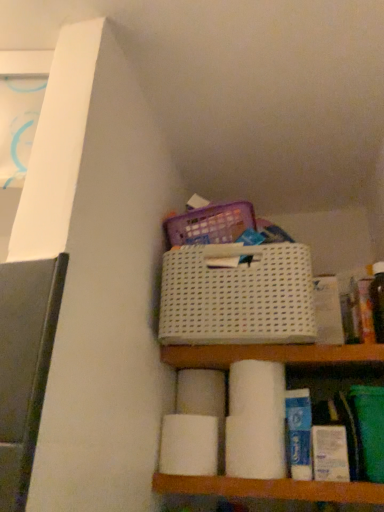
What do you see at coordinates (256, 421) in the screenshot?
I see `white matte toilet paper at center, the first toilet paper when ordered from front to back` at bounding box center [256, 421].

How much space does white matte toilet paper at center, the first toilet paper when ordered from front to back, occupy horizontally?

The width of white matte toilet paper at center, the first toilet paper when ordered from front to back, is 1.88 inches.

Locate an element on the screen. This screenshot has height=512, width=384. white matte toilet paper at lower center, arranged as the first toilet paper when viewed from the back is located at coordinates click(201, 393).

From the image's perspective, which object appears higher, white matte toilet paper at center, the 2th toilet paper from the front, or white mesh basket at center?

From the image's view, white mesh basket at center is above.

Based on their positions, is white matte toilet paper at center, the 2th toilet paper from the front, located to the left or right of white mesh basket at center?

white matte toilet paper at center, the 2th toilet paper from the front, is positioned on white mesh basket at center's left side.

In order to click on the 2nd toilet paper behind when counting from the white mesh basket at center in this screenshot , I will do `click(189, 445)`.

From the image's perspective, which one is positioned higher, white matte toilet paper at center, the 2th toilet paper from the front, or white matte toilet paper at lower center, arranged as the first toilet paper when viewed from the back?

white matte toilet paper at lower center, arranged as the first toilet paper when viewed from the back, from the image's perspective.

From their relative heights in the image, would you say white matte toilet paper at center, the 2th toilet paper from the front, is taller or shorter than white matte toilet paper at lower center, the third toilet paper when ordered from front to back?

Considering their sizes, white matte toilet paper at center, the 2th toilet paper from the front, has more height than white matte toilet paper at lower center, the third toilet paper when ordered from front to back.

Is white matte toilet paper at center, the 2th toilet paper from the front, in front of or behind white matte toilet paper at lower center, arranged as the first toilet paper when viewed from the back, in the image?

In the image, white matte toilet paper at center, the 2th toilet paper from the front, appears in front of white matte toilet paper at lower center, arranged as the first toilet paper when viewed from the back.

From the image's perspective, which toilet paper is the 2nd one below the white matte toilet paper at lower center, arranged as the first toilet paper when viewed from the back? Please provide its 2D coordinates.

[(189, 445)]

Considering the sizes of objects white matte toilet paper at center, the 2th toilet paper from the front, and white matte toilet paper at center, the first toilet paper when ordered from front to back, in the image provided, who is shorter, white matte toilet paper at center, the 2th toilet paper from the front, or white matte toilet paper at center, the first toilet paper when ordered from front to back,?

With less height is white matte toilet paper at center, the 2th toilet paper from the front.

Is white matte toilet paper at center, the 2th toilet paper from the front, far from white matte toilet paper at center, which is the third toilet paper in back-to-front order?

No, white matte toilet paper at center, the 2th toilet paper from the front, is not far from white matte toilet paper at center, which is the third toilet paper in back-to-front order.

Is white matte toilet paper at center, the 2th toilet paper from the front, completely or partially outside of white matte toilet paper at center, the first toilet paper when ordered from front to back?

That's correct, white matte toilet paper at center, the 2th toilet paper from the front, is outside of white matte toilet paper at center, the first toilet paper when ordered from front to back.

In order to click on basket on the right of white matte toilet paper at lower center, the third toilet paper when ordered from front to back in this screenshot , I will do `click(237, 298)`.

Which object is further away from the camera taking this photo, white matte toilet paper at lower center, arranged as the first toilet paper when viewed from the back, or white mesh basket at center?

white matte toilet paper at lower center, arranged as the first toilet paper when viewed from the back, is further from the camera.

Can you confirm if white matte toilet paper at lower center, the third toilet paper when ordered from front to back, is shorter than white mesh basket at center?

Indeed, white matte toilet paper at lower center, the third toilet paper when ordered from front to back, has a lesser height compared to white mesh basket at center.

From the image's perspective, between white matte toilet paper at lower center, arranged as the first toilet paper when viewed from the back, and white mesh basket at center, which one is located above?

white mesh basket at center.

In terms of size, does white mesh basket at center appear bigger or smaller than white matte toilet paper at center, which is the third toilet paper in back-to-front order?

white mesh basket at center is bigger than white matte toilet paper at center, which is the third toilet paper in back-to-front order.

From a real-world perspective, who is located lower, white mesh basket at center or white matte toilet paper at center, the first toilet paper when ordered from front to back?

In real-world perspective, white matte toilet paper at center, the first toilet paper when ordered from front to back, is lower.

What are the coordinates of `basket located in front of the white matte toilet paper at center, which is the third toilet paper in back-to-front order` in the screenshot? It's located at (237, 298).

At what (x,y) coordinates should I click in order to perform the action: click on toilet paper that is the 1st object to the left of the white mesh basket at center, starting at the anchor. Please return your answer as a coordinate pair (x, y). Image resolution: width=384 pixels, height=512 pixels. Looking at the image, I should click on (201, 393).

Is white mesh basket at center facing towards white matte toilet paper at lower center, arranged as the first toilet paper when viewed from the back?

No, white mesh basket at center is not turned towards white matte toilet paper at lower center, arranged as the first toilet paper when viewed from the back.

Considering the relative sizes of white mesh basket at center and white matte toilet paper at lower center, the third toilet paper when ordered from front to back, in the image provided, is white mesh basket at center smaller than white matte toilet paper at lower center, the third toilet paper when ordered from front to back,?

No, white mesh basket at center is not smaller than white matte toilet paper at lower center, the third toilet paper when ordered from front to back.

Considering the points (162, 272) and (188, 379), which point is in front, point (162, 272) or point (188, 379)?

The point (162, 272) is in front.

Consider the image. Is white matte toilet paper at center, which is the third toilet paper in back-to-front order, completely or partially inside white matte toilet paper at lower center, arranged as the first toilet paper when viewed from the back?

No, white matte toilet paper at center, which is the third toilet paper in back-to-front order, is not a part of white matte toilet paper at lower center, arranged as the first toilet paper when viewed from the back.

Image resolution: width=384 pixels, height=512 pixels. Identify the location of toilet paper that appears on the right of white matte toilet paper at lower center, arranged as the first toilet paper when viewed from the back. (256, 421).

From the image's perspective, is white matte toilet paper at lower center, the third toilet paper when ordered from front to back, located beneath white matte toilet paper at center, which is the third toilet paper in back-to-front order?

No, from the image's perspective, white matte toilet paper at lower center, the third toilet paper when ordered from front to back, is not below white matte toilet paper at center, which is the third toilet paper in back-to-front order.

Is white matte toilet paper at lower center, the third toilet paper when ordered from front to back, facing away from white matte toilet paper at center, which is the third toilet paper in back-to-front order?

No.

Where is `the 2nd toilet paper located beneath the white mesh basket at center (from a real-world perspective)`? The height and width of the screenshot is (512, 384). the 2nd toilet paper located beneath the white mesh basket at center (from a real-world perspective) is located at coordinates (189, 445).

From the image's perspective, which toilet paper is the 2nd one below the white matte toilet paper at lower center, the third toilet paper when ordered from front to back? Please provide its 2D coordinates.

[(189, 445)]

From the image, which object appears to be nearer to white matte toilet paper at lower center, the third toilet paper when ordered from front to back, white matte toilet paper at center, which is the third toilet paper in back-to-front order, or white mesh basket at center?

white matte toilet paper at center, which is the third toilet paper in back-to-front order, lies closer to white matte toilet paper at lower center, the third toilet paper when ordered from front to back, than the other object.

Based on their spatial positions, is white matte toilet paper at lower center, the third toilet paper when ordered from front to back, or white mesh basket at center further from white matte toilet paper at center, the first toilet paper when ordered from front to back?

white mesh basket at center is positioned further to the anchor white matte toilet paper at center, the first toilet paper when ordered from front to back.

When comparing their distances from white mesh basket at center, does white matte toilet paper at center, which is the 2th toilet paper in back-to-front order, or white matte toilet paper at center, which is the third toilet paper in back-to-front order, seem further?

The object further to white mesh basket at center is white matte toilet paper at center, which is the 2th toilet paper in back-to-front order.

Based on the photo, looking at the image, which one is located further to white mesh basket at center, white matte toilet paper at center, the 2th toilet paper from the front, or white matte toilet paper at lower center, the third toilet paper when ordered from front to back?

white matte toilet paper at center, the 2th toilet paper from the front.

Looking at the image, which one is located closer to white matte toilet paper at center, which is the 2th toilet paper in back-to-front order, white mesh basket at center or white matte toilet paper at lower center, the third toilet paper when ordered from front to back?

white matte toilet paper at lower center, the third toilet paper when ordered from front to back, is positioned closer to the anchor white matte toilet paper at center, which is the 2th toilet paper in back-to-front order.

Based on their spatial positions, is white matte toilet paper at center, which is the third toilet paper in back-to-front order, or white matte toilet paper at lower center, arranged as the first toilet paper when viewed from the back, closer to white mesh basket at center?

white matte toilet paper at center, which is the third toilet paper in back-to-front order, is closer to white mesh basket at center.

Consider the image. From the image, which object appears to be farther from white matte toilet paper at center, the first toilet paper when ordered from front to back, white mesh basket at center or white matte toilet paper at lower center, the third toilet paper when ordered from front to back?

white mesh basket at center.

Considering their positions, is white matte toilet paper at center, which is the third toilet paper in back-to-front order, positioned further to white matte toilet paper at lower center, the third toilet paper when ordered from front to back, than white matte toilet paper at center, which is the 2th toilet paper in back-to-front order?

Among the two, white matte toilet paper at center, which is the third toilet paper in back-to-front order, is located further to white matte toilet paper at lower center, the third toilet paper when ordered from front to back.

Locate an element on the screen. This screenshot has width=384, height=512. toilet paper located between white matte toilet paper at center, which is the third toilet paper in back-to-front order, and white matte toilet paper at lower center, the third toilet paper when ordered from front to back, in the depth direction is located at coordinates (189, 445).

Identify the location of toilet paper between white mesh basket at center and white matte toilet paper at center, which is the third toilet paper in back-to-front order, from top to bottom. This screenshot has width=384, height=512. (201, 393).